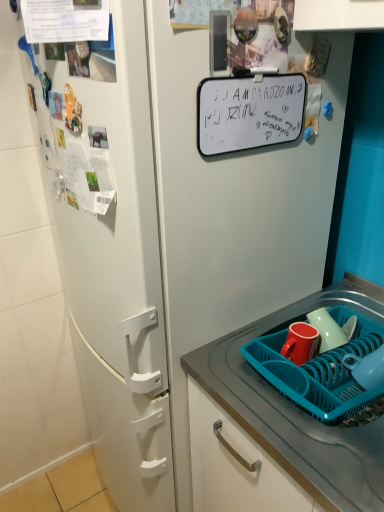
At what (x,y) coordinates should I click in order to perform the action: click on empty space that is ontop of teal plastic tray at lower right (from a real-world perspective). Please return your answer as a coordinate pair (x, y). This screenshot has width=384, height=512. Looking at the image, I should click on (314, 366).